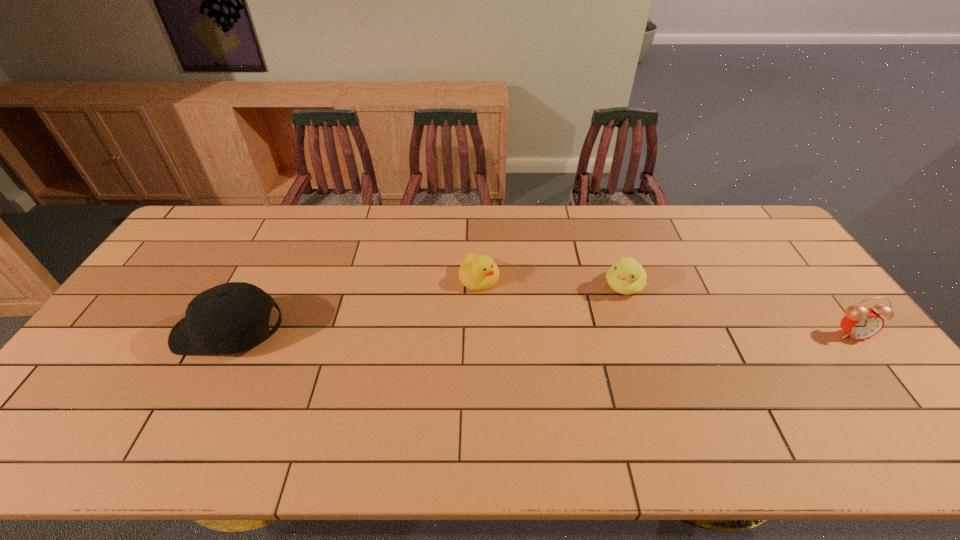
This screenshot has width=960, height=540. I want to click on baseball cap, so click(233, 317).

Where is `alarm clock`? This screenshot has width=960, height=540. alarm clock is located at coordinates (859, 323).

What are the coordinates of `the right duckling` in the screenshot? It's located at (626, 276).

At what (x,y) coordinates should I click in order to perform the action: click on the left duckling. Please return your answer as a coordinate pair (x, y). The width and height of the screenshot is (960, 540). Looking at the image, I should click on (477, 272).

This screenshot has width=960, height=540. I want to click on the second object from left to right, so click(477, 272).

You are a GUI agent. You are given a task and a screenshot of the screen. Output one action in this format:
    pyautogui.click(x=<x>, y=<y>)
    Task: Click on the vacant space located with a logo on the front of the baseball cap
    
    Given the screenshot: What is the action you would take?
    pyautogui.click(x=135, y=333)

Where is `vacant area located 0.060m with a logo on the front of the baseball cap`? The height and width of the screenshot is (540, 960). vacant area located 0.060m with a logo on the front of the baseball cap is located at coordinates (154, 333).

Image resolution: width=960 pixels, height=540 pixels. Find the location of `free space located 0.100m with a logo on the front of the baseball cap`. free space located 0.100m with a logo on the front of the baseball cap is located at coordinates (139, 333).

Locate an element on the screen. vacant area situated 0.160m on the clock face of the alarm clock is located at coordinates (898, 394).

Find the location of a particular element. vacant space positioned 0.350m at the beak of the second object from right to left is located at coordinates (554, 376).